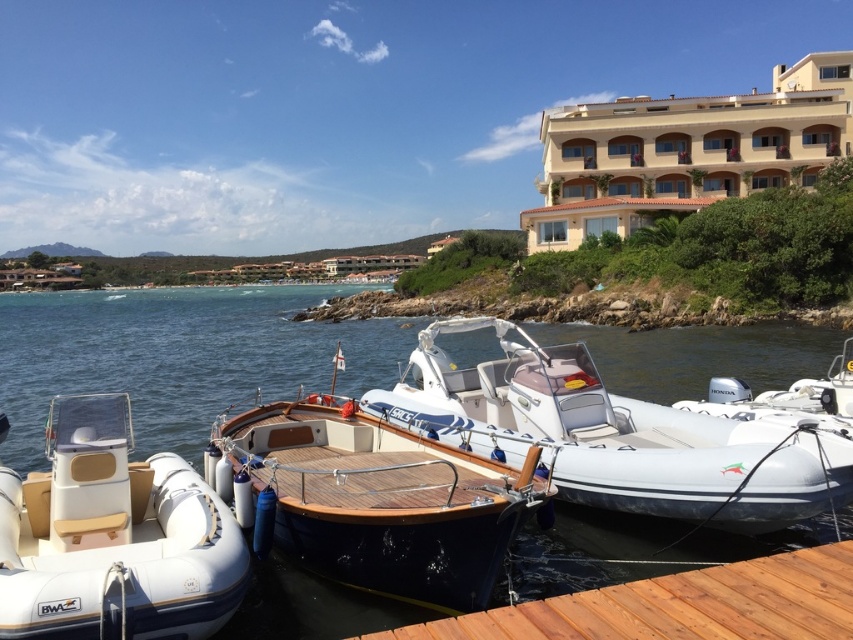
Question: Can you confirm if white rubber boat at lower left is positioned above beige stucco building at upper right?

Choices:
 (A) no
 (B) yes

Answer: (A)

Question: Does white rubber boat at center have a smaller size compared to teak wood boat at center?

Choices:
 (A) no
 (B) yes

Answer: (A)

Question: Which object is farther from the camera taking this photo?

Choices:
 (A) white rubber boat at center
 (B) brown wooden dock at lower right
 (C) teak wood boat at center
 (D) beige stucco building at upper right

Answer: (D)

Question: Which object appears closest to the camera in this image?

Choices:
 (A) brown wooden dock at lower right
 (B) blue water at center
 (C) beige stucco building at upper right
 (D) white rubber boat at center

Answer: (A)

Question: Observing the image, what is the correct spatial positioning of blue water at center in reference to white rubber boat at lower left?

Choices:
 (A) left
 (B) right

Answer: (A)

Question: Which of the following is the closest to the observer?

Choices:
 (A) white rubber boat at lower left
 (B) blue water at center
 (C) beige stucco building at upper right
 (D) white rubber boat at center

Answer: (A)